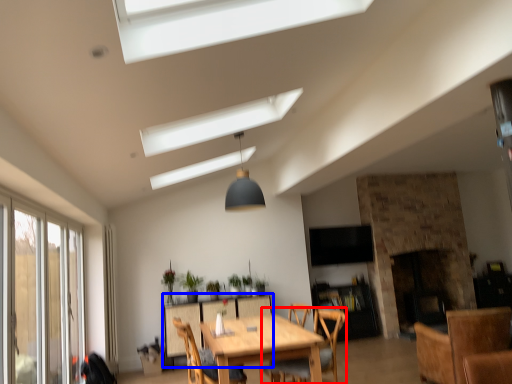
Question: Which object appears closest to the camera in this image, chair (highlighted by a red box) or table (highlighted by a blue box)?

Choices:
 (A) chair
 (B) table

Answer: (A)